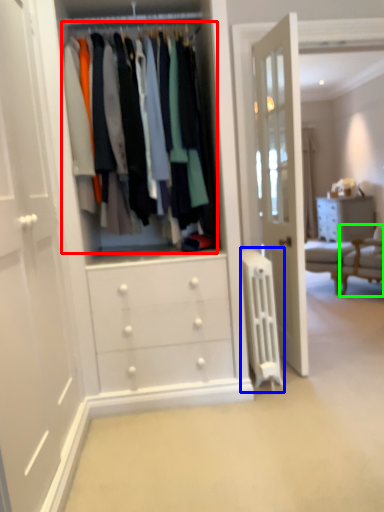
Question: Based on their relative distances, which object is farther from closet (highlighted by a red box)? Choose from wide (highlighted by a blue box) and furniture (highlighted by a green box).

Choices:
 (A) wide
 (B) furniture

Answer: (B)